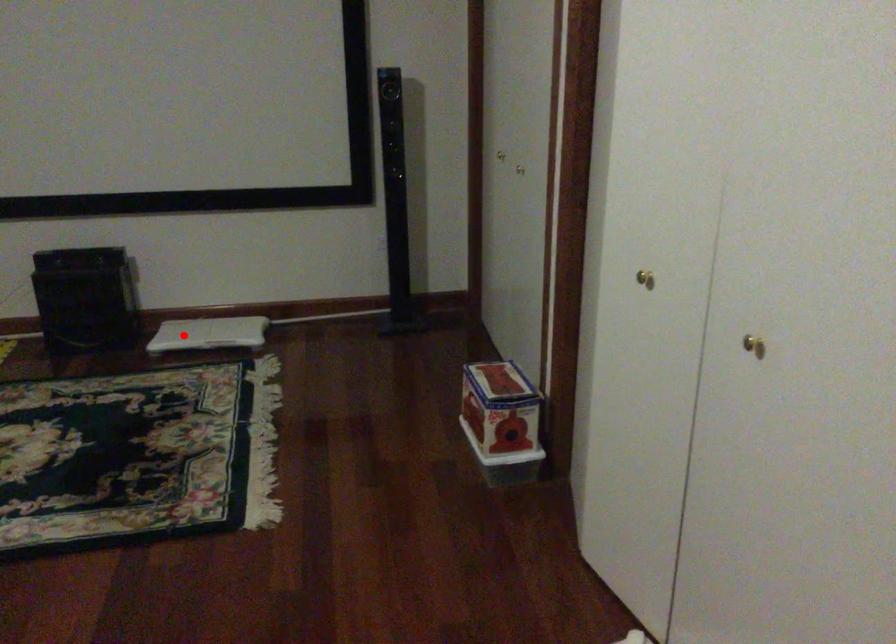
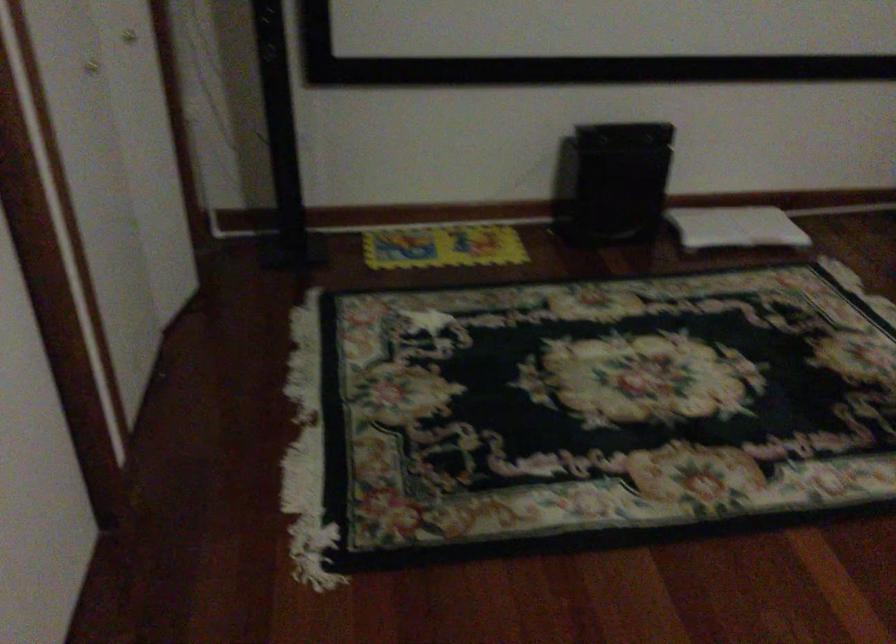
Find the pixel in the second image that matches the highlighted location in the first image.

(735, 227)